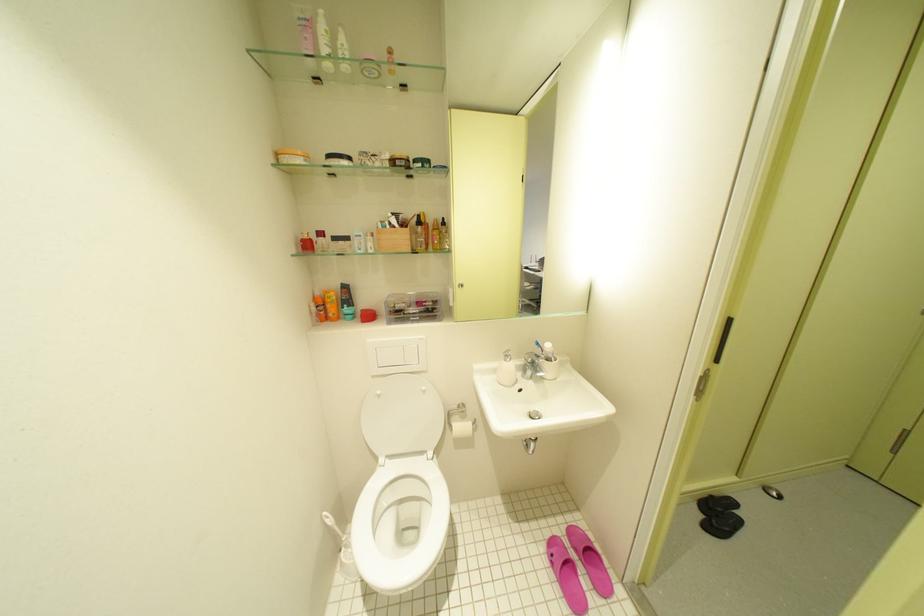
Locate an element on the screen. This screenshot has height=616, width=924. toilet brush handle is located at coordinates (334, 528).